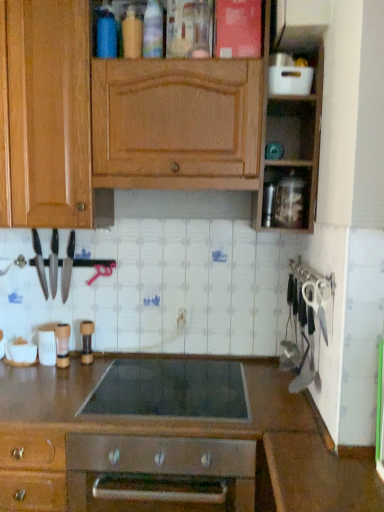
Image resolution: width=384 pixels, height=512 pixels. I want to click on vacant area to the right of clear plastic container at lower left, the 3th appliance when ordered from left to right, so click(x=100, y=368).